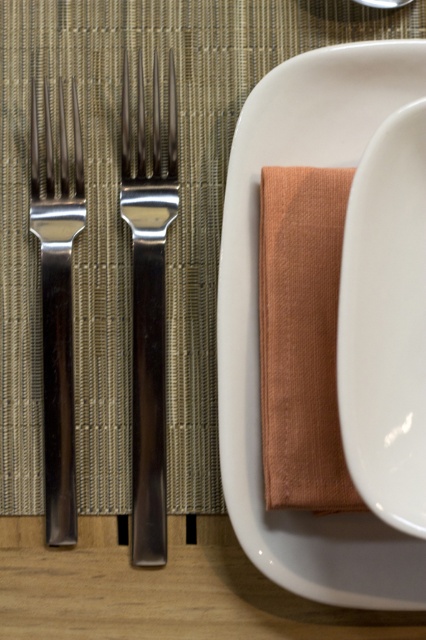
Between point (408, 348) and point (49, 394), which one is positioned in front?

Point (408, 348)

Which is below, white glossy plate at upper right or polished silver fork at left?

Positioned lower is white glossy plate at upper right.

Who is more distant from viewer, (402, 369) or (57, 296)?

Point (57, 296)

What are the coordinates of `white glossy plate at upper right` in the screenshot? It's located at (385, 323).

Is white matte platter at center smaller than polished silver fork at left?

Incorrect, white matte platter at center is not smaller in size than polished silver fork at left.

Is point (325, 134) farther from viewer compared to point (32, 125)?

Yes, point (325, 134) is farther from viewer.

You are a GUI agent. You are given a task and a screenshot of the screen. Output one action in this format:
    pyautogui.click(x=<x>, y=<y>)
    Task: Click on the white matte platter at center
    The width and height of the screenshot is (426, 640).
    Given the screenshot: What is the action you would take?
    pyautogui.click(x=256, y=310)

Locate an element on the screen. The height and width of the screenshot is (640, 426). white matte platter at center is located at coordinates (256, 310).

Find the location of a particular element. white matte platter at center is located at coordinates (256, 310).

How much distance is there between white matte platter at center and polished silver fork at center?

A distance of 2.07 inches exists between white matte platter at center and polished silver fork at center.

Is point (405, 44) closer to camera compared to point (137, 420)?

That is True.

Where is `white matte platter at center`? Image resolution: width=426 pixels, height=640 pixels. white matte platter at center is located at coordinates (256, 310).